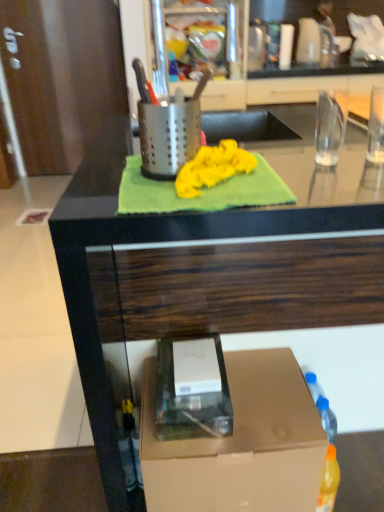
Question: Is yellow fabric at center at the left side of brown cardboard box at lower right?

Choices:
 (A) yes
 (B) no

Answer: (A)

Question: Is yellow fabric at center aimed at brown cardboard box at lower right?

Choices:
 (A) no
 (B) yes

Answer: (A)

Question: Can you confirm if yellow fabric at center is shorter than brown cardboard box at lower right?

Choices:
 (A) yes
 (B) no

Answer: (A)

Question: Is yellow fabric at center with brown cardboard box at lower right?

Choices:
 (A) yes
 (B) no

Answer: (B)

Question: Considering the relative sizes of yellow fabric at center and brown cardboard box at lower right in the image provided, is yellow fabric at center wider than brown cardboard box at lower right?

Choices:
 (A) no
 (B) yes

Answer: (B)

Question: Considering the positions of yellow fabric at center and brown cardboard box at lower right in the image, is yellow fabric at center wider or thinner than brown cardboard box at lower right?

Choices:
 (A) wide
 (B) thin

Answer: (A)

Question: Considering the relative positions of yellow fabric at center and brown cardboard box at lower right in the image provided, is yellow fabric at center to the left or to the right of brown cardboard box at lower right?

Choices:
 (A) left
 (B) right

Answer: (A)

Question: From a real-world perspective, is yellow fabric at center positioned above or below brown cardboard box at lower right?

Choices:
 (A) above
 (B) below

Answer: (A)

Question: Is yellow fabric at center bigger or smaller than brown cardboard box at lower right?

Choices:
 (A) big
 (B) small

Answer: (B)

Question: From a real-world perspective, relative to brown cardboard box at lower right, is yellow fabric at center vertically above or below?

Choices:
 (A) below
 (B) above

Answer: (B)

Question: Is yellow fabric at center inside or outside of brown cardboard box at lower right?

Choices:
 (A) inside
 (B) outside

Answer: (B)

Question: Looking at their shapes, would you say yellow fabric at center is wider or thinner than brown cardboard box at lower right?

Choices:
 (A) wide
 (B) thin

Answer: (B)

Question: In the image, is yellow fabric at center on the left side or the right side of brown cardboard box at lower right?

Choices:
 (A) right
 (B) left

Answer: (B)

Question: From a real-world perspective, is green fabric at upper center positioned above or below yellow fabric at center?

Choices:
 (A) below
 (B) above

Answer: (A)

Question: Considering the positions of green fabric at upper center and yellow fabric at center in the image, is green fabric at upper center wider or thinner than yellow fabric at center?

Choices:
 (A) thin
 (B) wide

Answer: (B)